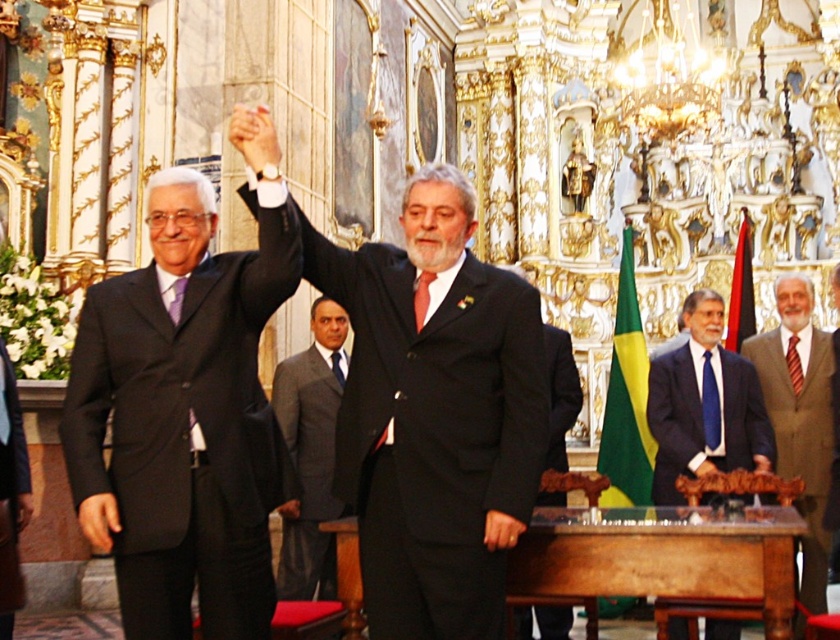
Does point (746, 532) come behind point (281, 387)?

No, it is not.

Can you confirm if wooden altar at center is positioned to the left of gray wool suit at center?

In fact, wooden altar at center is to the right of gray wool suit at center.

Is point (739, 595) positioned after point (291, 520)?

No.

You are a GUI agent. You are given a task and a screenshot of the screen. Output one action in this format:
    pyautogui.click(x=<x>, y=<y>)
    Task: Click on the wooden altar at center
    The height and width of the screenshot is (640, 840).
    Given the screenshot: What is the action you would take?
    pyautogui.click(x=662, y=556)

Consider the image. Is matte black suit at left positioned at the back of wooden altar at center?

Yes, it is behind wooden altar at center.

Is point (161, 193) more distant than point (539, 580)?

Yes, it is.

Does point (198, 296) come farther from viewer compared to point (526, 547)?

Yes, point (198, 296) is farther from viewer.

Where is `matte black suit at left`? matte black suit at left is located at coordinates pyautogui.click(x=185, y=406).

This screenshot has width=840, height=640. Describe the element at coordinates (185, 406) in the screenshot. I see `matte black suit at left` at that location.

This screenshot has width=840, height=640. In order to click on matte black suit at left in this screenshot , I will do `click(185, 406)`.

Where is `matte black suit at left`? The image size is (840, 640). matte black suit at left is located at coordinates pos(185,406).